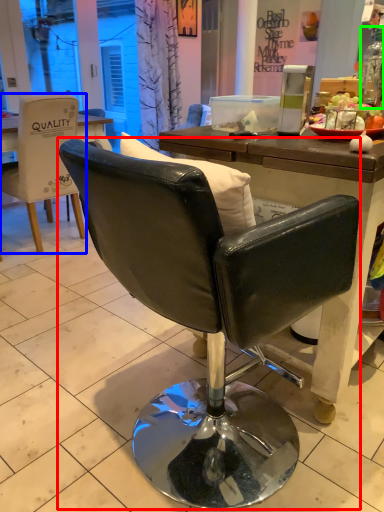
Question: Which is farther away from chair (highlighted by a red box)? chair (highlighted by a blue box) or bottle (highlighted by a green box)?

Choices:
 (A) chair
 (B) bottle

Answer: (A)